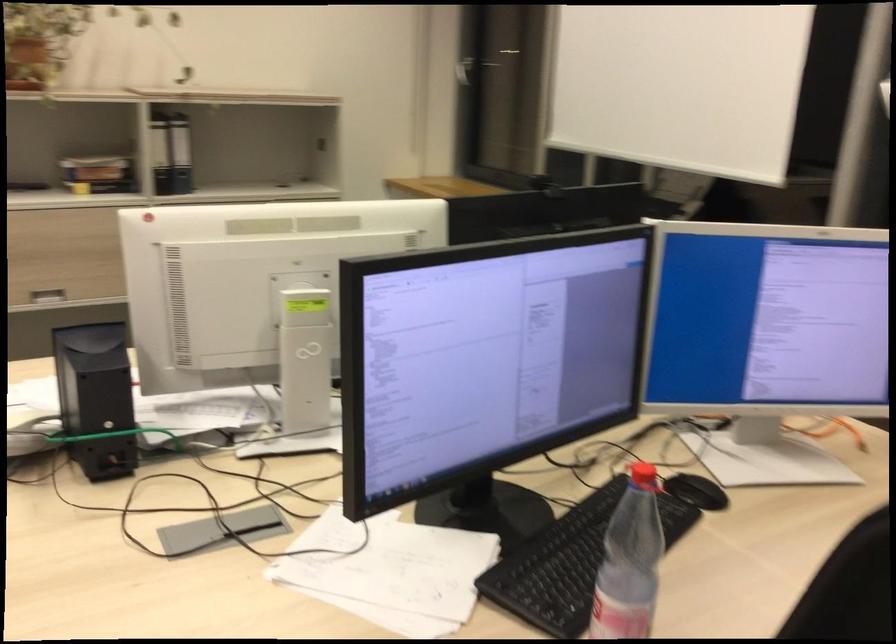
What do you see at coordinates (642, 478) in the screenshot? I see `the red bottle cap` at bounding box center [642, 478].